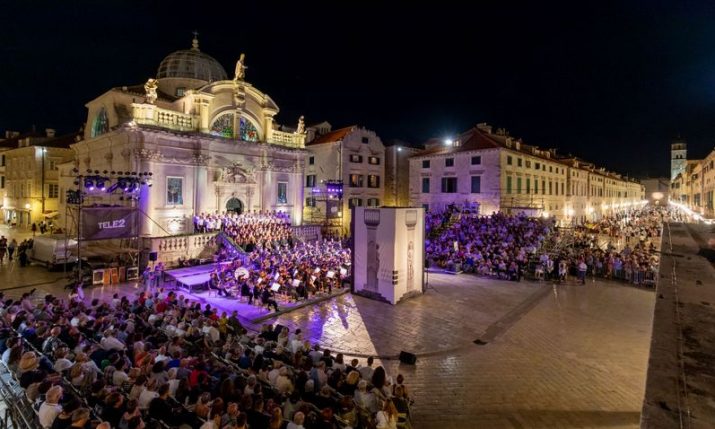
This screenshot has height=429, width=715. In order to click on statue in this screenshot , I will do `click(240, 72)`, `click(151, 97)`, `click(299, 126)`.